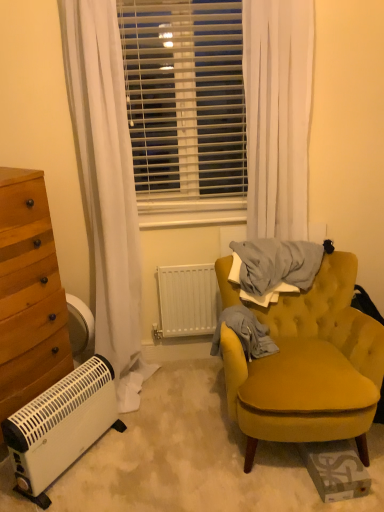
Question: Is point (41, 394) positioned closer to the camera than point (28, 245)?

Choices:
 (A) farther
 (B) closer

Answer: (A)

Question: Based on their sizes in the image, would you say white plastic heater at lower left is bigger or smaller than wooden chest of drawers at left?

Choices:
 (A) big
 (B) small

Answer: (B)

Question: Which of these objects is positioned closest to the wooden chest of drawers at left?

Choices:
 (A) white plastic blinds at center
 (B) velvet yellow armchair at right
 (C) white matte radiator at center
 (D) light gray cotton blanket at center right
 (E) white sheer curtain at upper center

Answer: (C)

Question: Which of these objects is positioned farthest from the white matte radiator at center?

Choices:
 (A) light gray cotton blanket at center right
 (B) white plastic heater at lower left
 (C) wooden chest of drawers at left
 (D) velvet yellow armchair at right
 (E) white plastic blinds at center

Answer: (B)